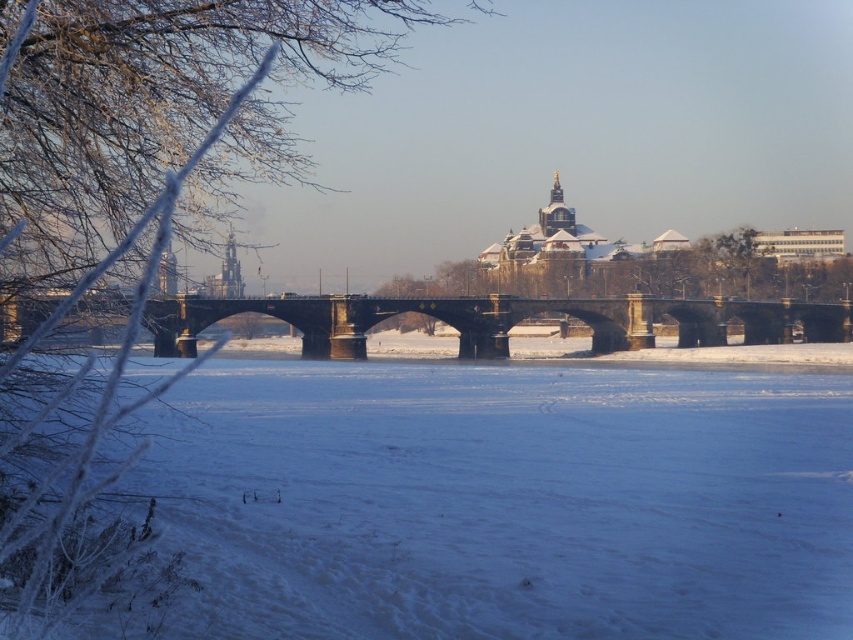
You are an engineer assessing the safety of the stone bridge at center for pedestrians. The snow on the white powdery snow at center has a density of 0.2 g per cubic centimeter. If the bridge can support a maximum weight of 10,000 kilograms, how many cubic meters of snow could the bridge safely hold without collapsing?

The stone bridge at center can safely hold 500 cubic meters of snow. Since the snow density is 0.2 g per cubic centimeter, 500 cubic meters equals 500,000,000 cubic centimeters. Multiplying by 0.2 g gives 100,000,000 grams, which is 100,000 kilograms. However, the bridge can only support 10,000 kilograms, so the maximum allowable snow volume is 50 cubic meters.

You are standing on the stone bridge and want to walk to the white powdery snow at center. Which direction should you move relative to the bridge?

The white powdery snow at center is located at point (x=505, y=500), so you should move towards the center of the bridge to reach it.